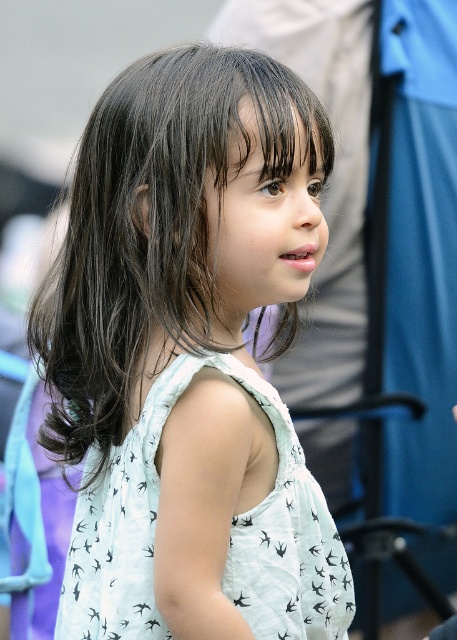
Question: Is white printed dress at center above white printed fabric dress at center?

Choices:
 (A) yes
 (B) no

Answer: (A)

Question: Which object is closer to the camera taking this photo?

Choices:
 (A) white printed dress at center
 (B) white printed fabric dress at center

Answer: (A)

Question: Can you confirm if white printed dress at center is smaller than white printed fabric dress at center?

Choices:
 (A) yes
 (B) no

Answer: (B)

Question: Among these points, which one is farthest from the camera?

Choices:
 (A) (256, 493)
 (B) (150, 522)

Answer: (A)

Question: Observing the image, what is the correct spatial positioning of white printed dress at center in reference to white printed fabric dress at center?

Choices:
 (A) left
 (B) right

Answer: (A)